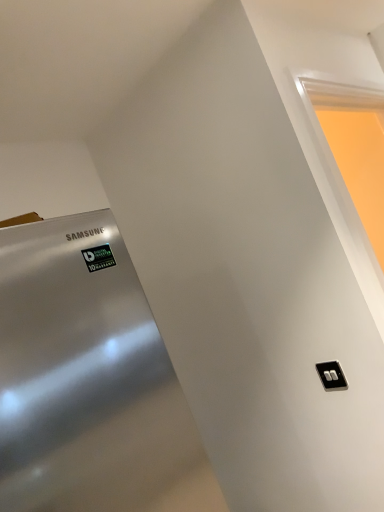
Question: In the image, is matte white frame at upper right positioned in front of or behind black plastic/light switch at lower right?

Choices:
 (A) front
 (B) behind

Answer: (A)

Question: From the image's perspective, is matte white frame at upper right located above or below black plastic/light switch at lower right?

Choices:
 (A) above
 (B) below

Answer: (A)

Question: Is point (359, 97) closer or farther from the camera than point (317, 369)?

Choices:
 (A) farther
 (B) closer

Answer: (A)

Question: Considering the positions of black plastic/light switch at lower right and matte white frame at upper right in the image, is black plastic/light switch at lower right wider or thinner than matte white frame at upper right?

Choices:
 (A) wide
 (B) thin

Answer: (B)

Question: Which is correct: black plastic/light switch at lower right is inside matte white frame at upper right, or outside of it?

Choices:
 (A) outside
 (B) inside

Answer: (A)

Question: Considering their positions, is black plastic/light switch at lower right located in front of or behind matte white frame at upper right?

Choices:
 (A) front
 (B) behind

Answer: (B)

Question: From their relative heights in the image, would you say black plastic/light switch at lower right is taller or shorter than matte white frame at upper right?

Choices:
 (A) short
 (B) tall

Answer: (A)